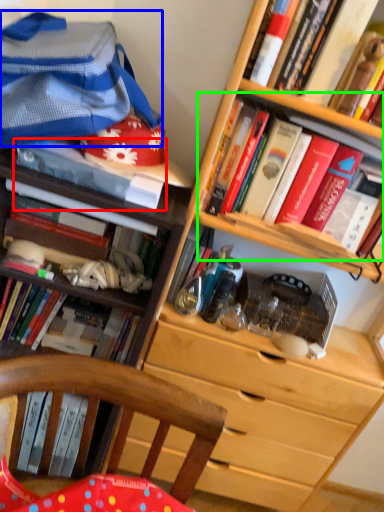
Question: Which object is the closest to the book (highlighted by a red box)? Choose among these: clothing (highlighted by a blue box) or book (highlighted by a green box).

Choices:
 (A) clothing
 (B) book

Answer: (A)